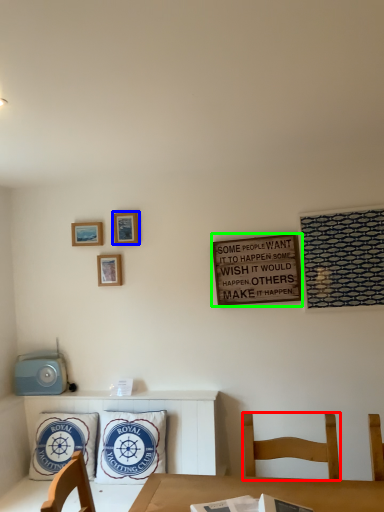
Question: Estimate the real-world distances between objects in this image. Which object is farther from chair (highlighted by a red box), picture frame (highlighted by a blue box) or bulletin board (highlighted by a green box)?

Choices:
 (A) picture frame
 (B) bulletin board

Answer: (A)